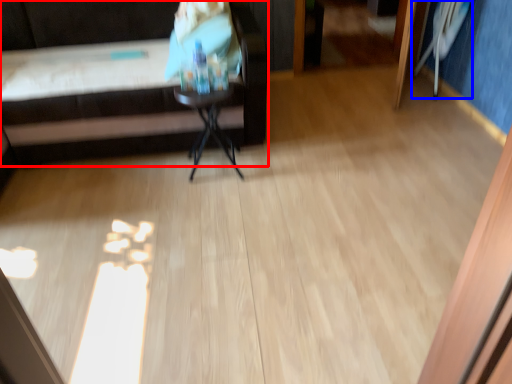
Question: Which of the following is the closest to the observer, furniture (highlighted by a red box) or swivel chair (highlighted by a blue box)?

Choices:
 (A) furniture
 (B) swivel chair

Answer: (A)